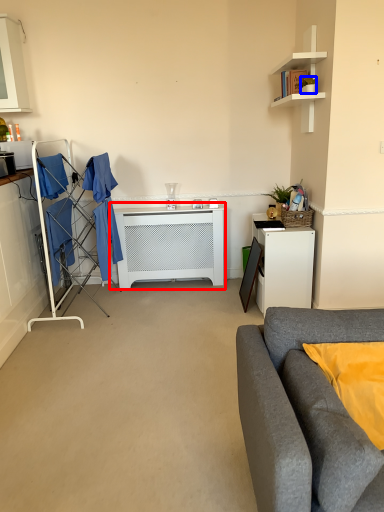
Question: Which of the following is the closest to the observer, table (highlighted by a red box) or houseplant (highlighted by a blue box)?

Choices:
 (A) table
 (B) houseplant

Answer: (B)